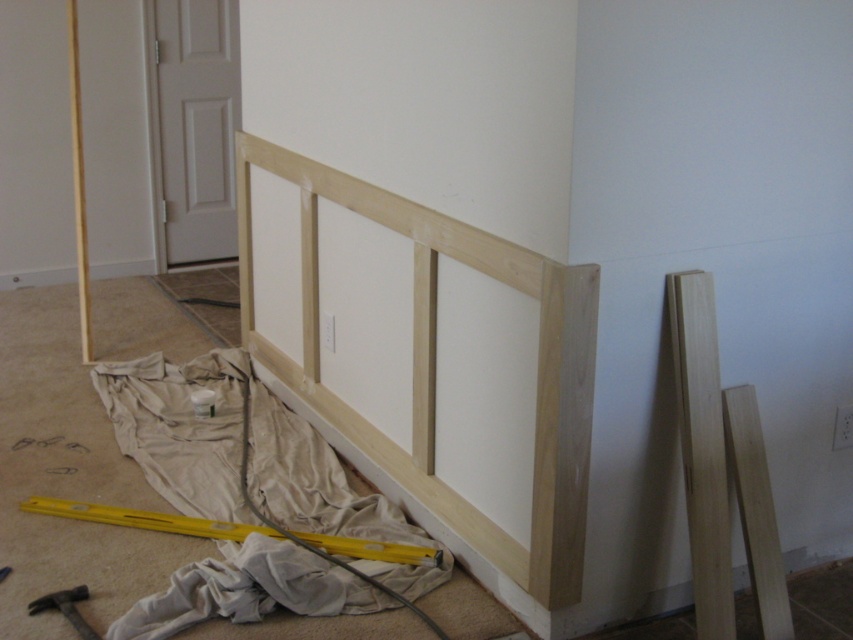
Question: Which of the following is the closest to the observer?

Choices:
 (A) silver metallic hammer at lower left
 (B) yellow wood beam at lower center

Answer: (A)

Question: Can you confirm if yellow wood beam at lower center is positioned below silver metallic hammer at lower left?

Choices:
 (A) no
 (B) yes

Answer: (A)

Question: Among these points, which one is farthest from the camera?

Choices:
 (A) (165, 516)
 (B) (86, 593)

Answer: (A)

Question: Where is yellow wood beam at lower center located in relation to silver metallic hammer at lower left in the image?

Choices:
 (A) above
 (B) below

Answer: (A)

Question: From the image, what is the correct spatial relationship of yellow wood beam at lower center in relation to silver metallic hammer at lower left?

Choices:
 (A) right
 (B) left

Answer: (A)